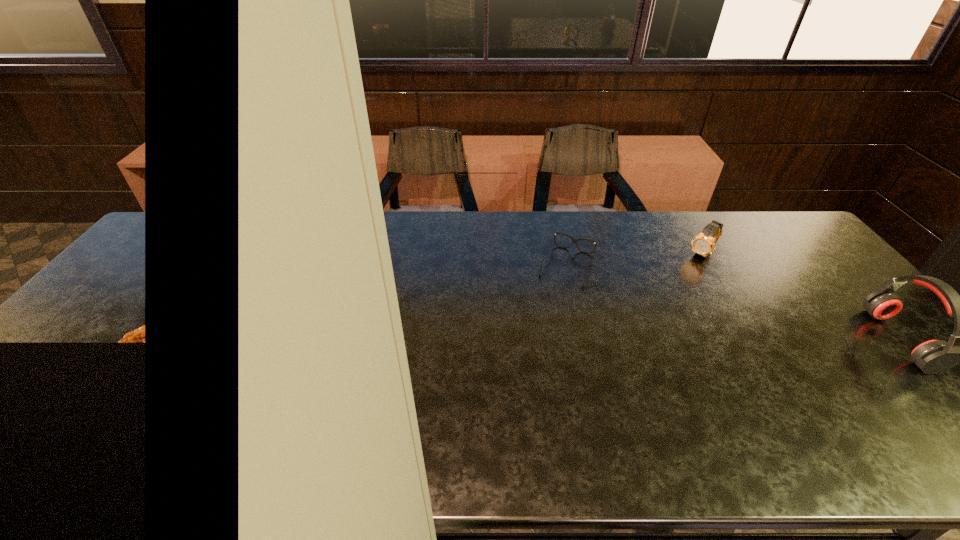
Locate an element on the screen. The height and width of the screenshot is (540, 960). free space that satisfies the following two spatial constraints: 1. on the front side of the second shortest object; 2. on the ear cups of the nearest object is located at coordinates (756, 340).

The height and width of the screenshot is (540, 960). I want to click on free spot that satisfies the following two spatial constraints: 1. on the front side of the second object from left to right; 2. on the ear cups of the nearest object, so click(756, 340).

This screenshot has width=960, height=540. I want to click on blank space that satisfies the following two spatial constraints: 1. on the front side of the rightmost object; 2. on the ear cups of the spectacles, so click(585, 340).

Where is `vacant area that satisfies the following two spatial constraints: 1. on the front side of the spectacles; 2. on the ear cups of the nearest object`? This screenshot has width=960, height=540. vacant area that satisfies the following two spatial constraints: 1. on the front side of the spectacles; 2. on the ear cups of the nearest object is located at coordinates (585, 340).